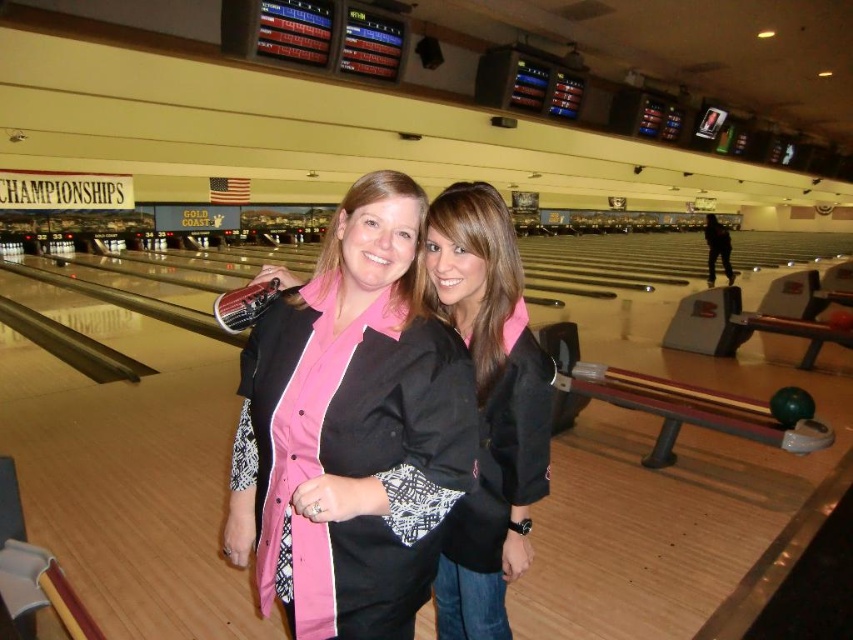
Looking at this image, you are a photographer standing in front of the two women in the bowling alley. You want to take a closeup shot of the pink fabric shirt at center without the black matte jacket at center blocking the view. Is this possible?

The pink fabric shirt at center is in front of the black matte jacket at center, so yes, you can take a closeup shot of the pink fabric shirt at center without the black matte jacket at center blocking the view because it is already positioned in front.

You are standing at the entrance of the bowling alley and notice a pink fabric shirt at center. Can you confirm if this shirt is located at the point with coordinates (352,428)?

Yes, the pink fabric shirt at center is located at point (352,428).

You are a photographer standing at the back of the bowling alley and want to take a closeup shot of both the pink fabric shirt at center and the black matte jacket at center. Can you fit both into the frame of your camera which has a minimum focus distance of 30 centimeters?

The pink fabric shirt at center and black matte jacket at center are 32.83 centimeters apart from each other, so yes, the photographer can fit both into the frame since the distance between them is within the camera focus range of 30 centimeters.